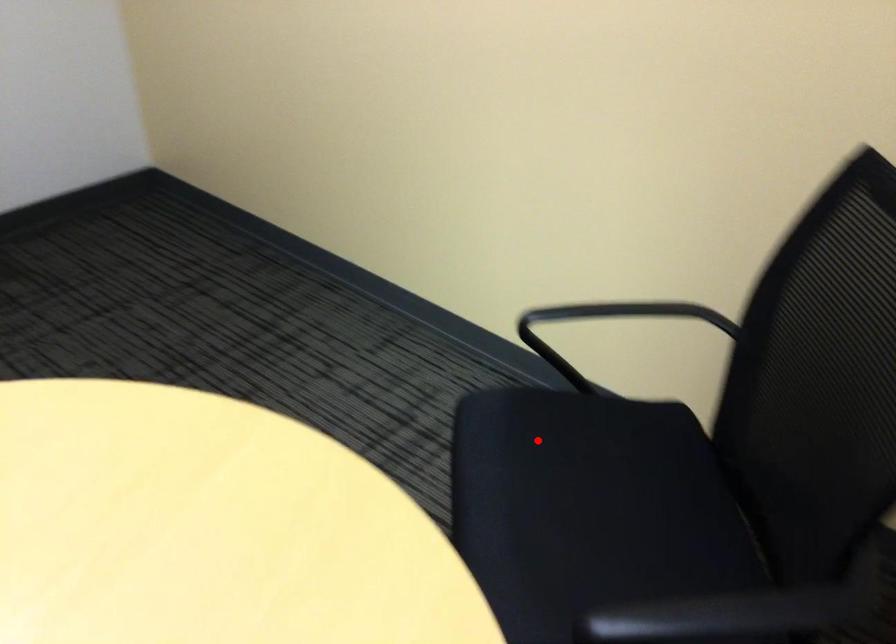
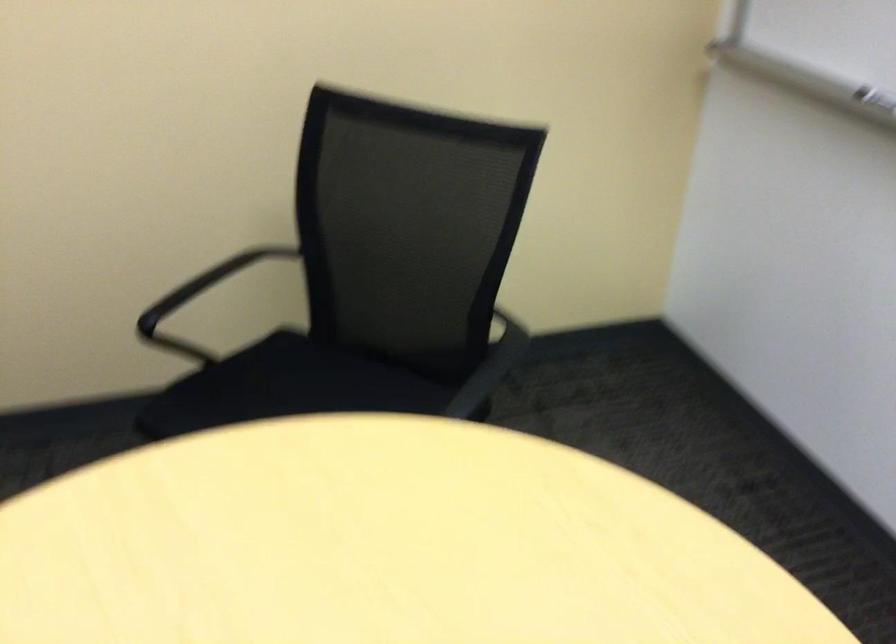
The point at the highlighted location is marked in the first image. Where is the corresponding point in the second image?

(231, 402)